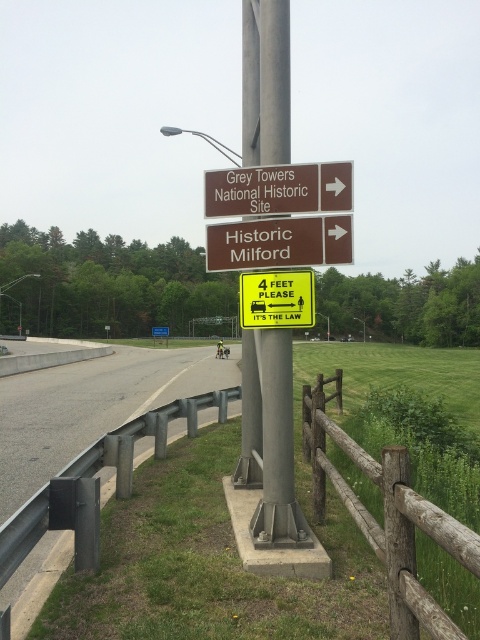
Between brown wooden fence at lower right and yellow plastic sign at center, which one has more height?

yellow plastic sign at center is taller.

Between point (387, 589) and point (284, 282), which one is positioned behind?

Point (284, 282)

Find the location of a particular element. brown wooden fence at lower right is located at coordinates (386, 516).

Between metallic gray pole at center and yellow plastic sign at center, which one is positioned higher?

Positioned higher is metallic gray pole at center.

Can you confirm if metallic gray pole at center is bigger than yellow plastic sign at center?

Correct, metallic gray pole at center is larger in size than yellow plastic sign at center.

The width and height of the screenshot is (480, 640). Describe the element at coordinates (272, 436) in the screenshot. I see `metallic gray pole at center` at that location.

Where is `metallic gray pole at center`? This screenshot has width=480, height=640. metallic gray pole at center is located at coordinates (272, 436).

Is point (327, 218) positioned after point (248, 280)?

No, (327, 218) is in front of (248, 280).

Is point (345, 237) closer to camera compared to point (286, 307)?

Yes.

Where is `brown wooden sign at center`? The image size is (480, 640). brown wooden sign at center is located at coordinates (278, 243).